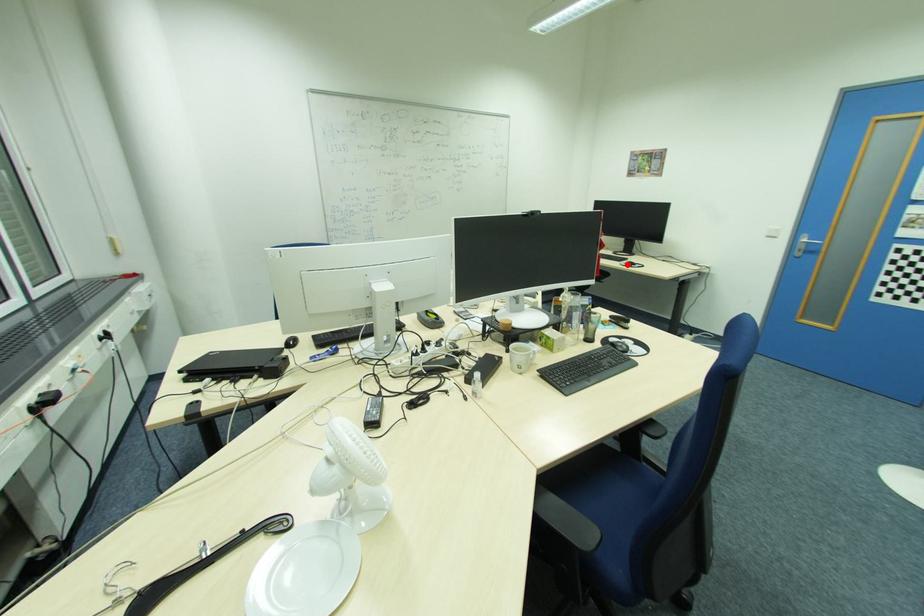
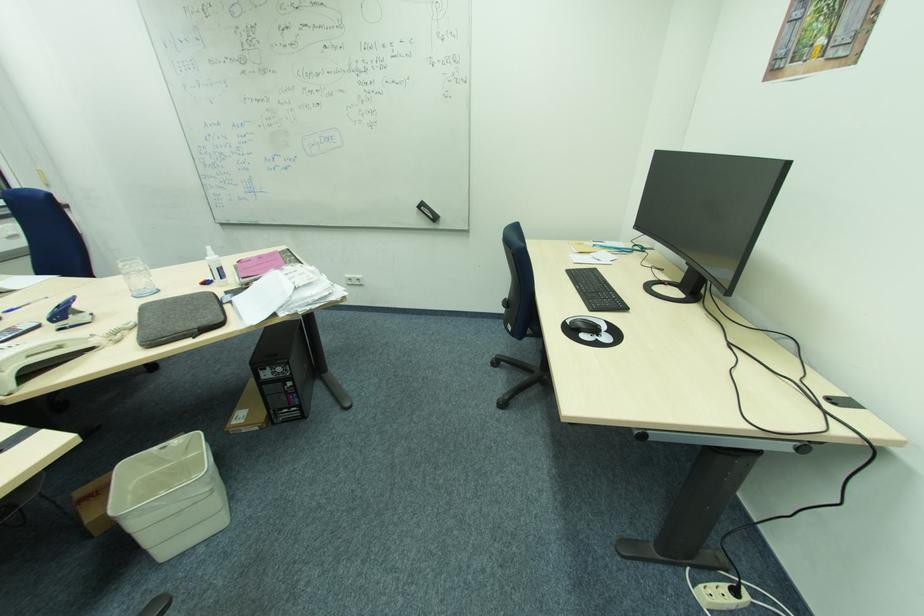
Question: I am providing you with two images of the same scene from different viewpoints. In image1, a red point is highlighted. Considering the same 3D point in image2, which of the following is correct?

Choices:
 (A) It is closer
 (B) It is farther

Answer: (A)